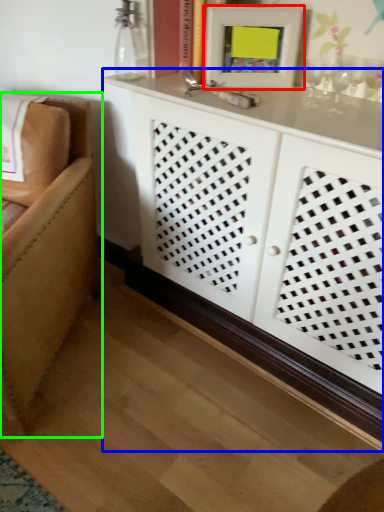
Question: Which object is the closest to the picture frame (highlighted by a red box)? Choose among these: cabinetry (highlighted by a blue box) or furniture (highlighted by a green box).

Choices:
 (A) cabinetry
 (B) furniture

Answer: (A)